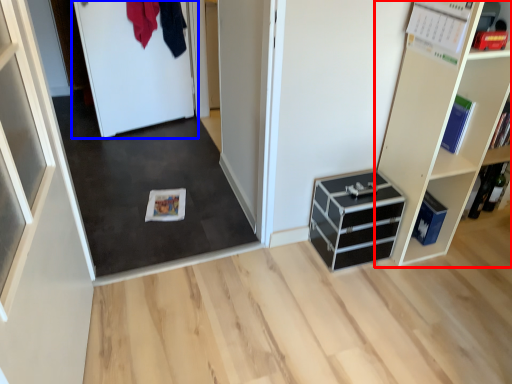
Question: Which point is closer to the camera, shelf (highlighted by a red box) or door (highlighted by a blue box)?

Choices:
 (A) shelf
 (B) door

Answer: (A)